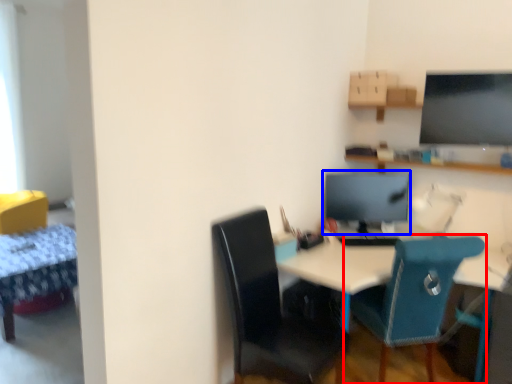
Question: Which object is closer to the camera taking this photo, chair (highlighted by a red box) or computer monitor (highlighted by a blue box)?

Choices:
 (A) chair
 (B) computer monitor

Answer: (A)